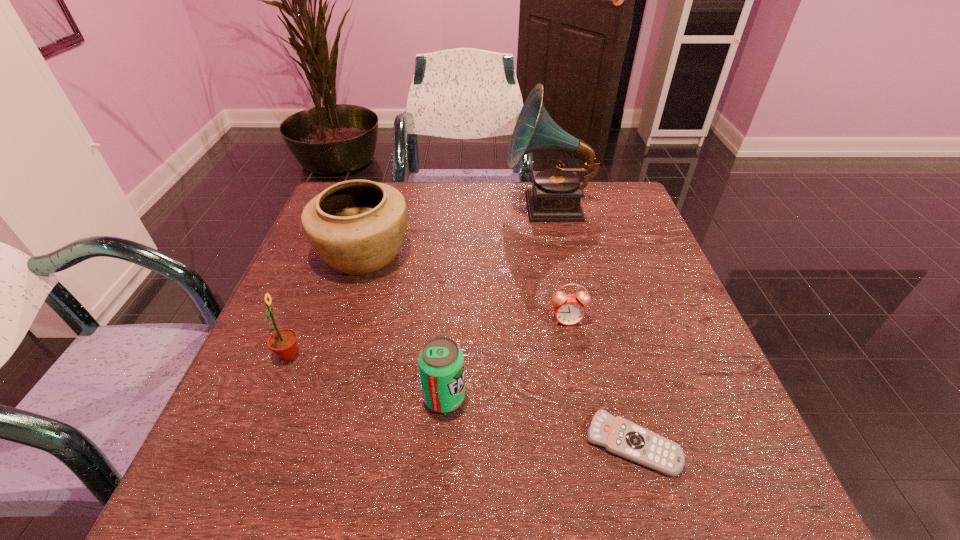
Where is `vacant space located 0.290m from the horn of the phonograph_record`? vacant space located 0.290m from the horn of the phonograph_record is located at coordinates (405, 207).

This screenshot has width=960, height=540. Identify the location of vacant region located on the back of the pottery. (380, 202).

At what (x,y) coordinates should I click in order to perform the action: click on vacant space situated on the face of the fourth farthest object. Please return your answer as a coordinate pair (x, y). Looking at the image, I should click on (498, 355).

The image size is (960, 540). Identify the location of free spot located 0.280m on the front-facing side of the pop soda. (619, 397).

Image resolution: width=960 pixels, height=540 pixels. I want to click on free space located 0.290m on the clock face of the alarm clock, so click(595, 461).

You are a GUI agent. You are given a task and a screenshot of the screen. Output one action in this format:
    pyautogui.click(x=<x>, y=<y>)
    Task: Click on the vacant space located on the back of the shortest object
    This screenshot has height=540, width=960.
    Given the screenshot: What is the action you would take?
    pyautogui.click(x=588, y=277)

Image resolution: width=960 pixels, height=540 pixels. Find the location of `phonograph_record that is positioned at the far edge`. phonograph_record that is positioned at the far edge is located at coordinates (556, 193).

At what (x,y) coordinates should I click in order to perform the action: click on pottery that is positioned at the far edge. Please return your answer as a coordinate pair (x, y). Looking at the image, I should click on (357, 226).

Image resolution: width=960 pixels, height=540 pixels. What are the coordinates of `object present at the near edge` in the screenshot? It's located at (619, 436).

This screenshot has height=540, width=960. Find the location of `pottery that is positioned at the left edge`. pottery that is positioned at the left edge is located at coordinates pyautogui.click(x=357, y=226).